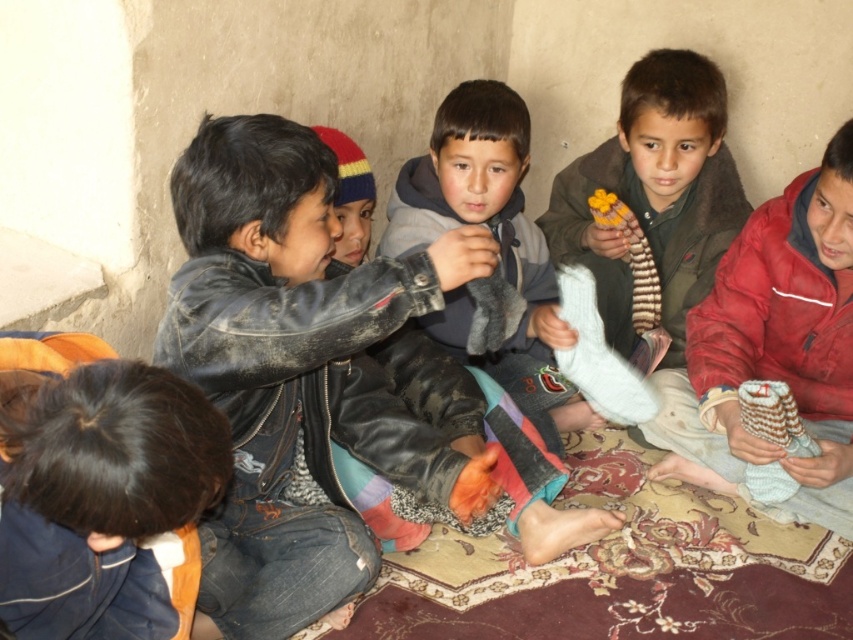
You are a photographer standing in the room with the children. You want to take a closeup photo of the leather jacket at center. The camera you are using has a minimum focusing distance of 1.2 meters. Can you take the photo without moving the camera or the jacket?

The distance between the leather jacket at center and the camera is 1.37 meters, which is greater than the camera minimum focusing distance of 1.2 meters. Therefore, you can take the closeup photo without moving the camera or the jacket.

You are a child sitting on the patterned rug with floral designs. You want to reach the knitted gray socks at lower right without moving your feet. Can you easily grab the gray fleece jacket at center first?

The gray fleece jacket at center is closer to you than the knitted gray socks at lower right, so you can easily grab the gray fleece jacket at center first before reaching for the knitted gray socks at lower right.

In the scene shown: You are standing in the room and want to place a small toy between the two points labeled point (627,216) and point (625,220). Based on their positions, which point should the toy be closer to in order to ensure it is placed in front of both points?

The toy should be placed closer to point (625,220) because point (627,216) is behind point (625,220), so placing it near the front point ensures it is in front of both.